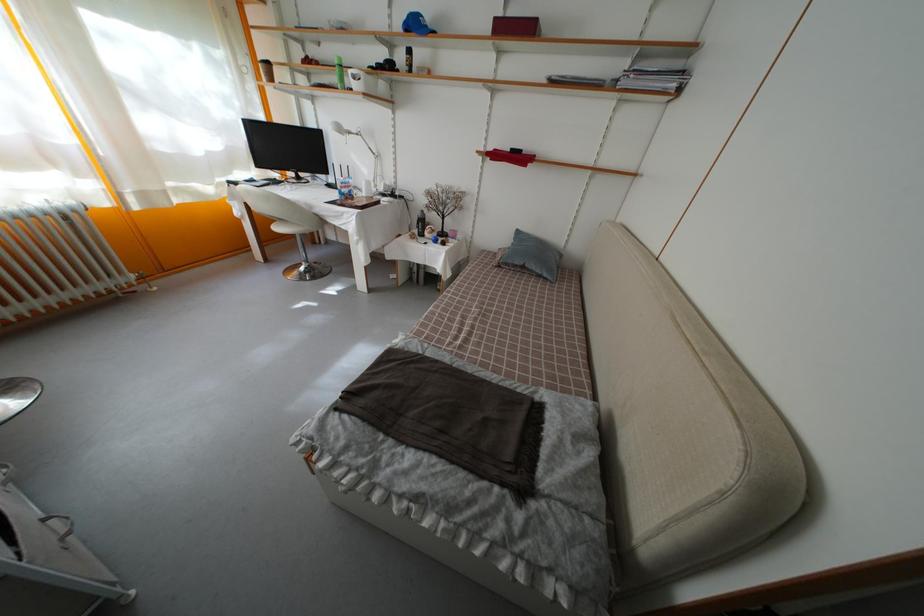
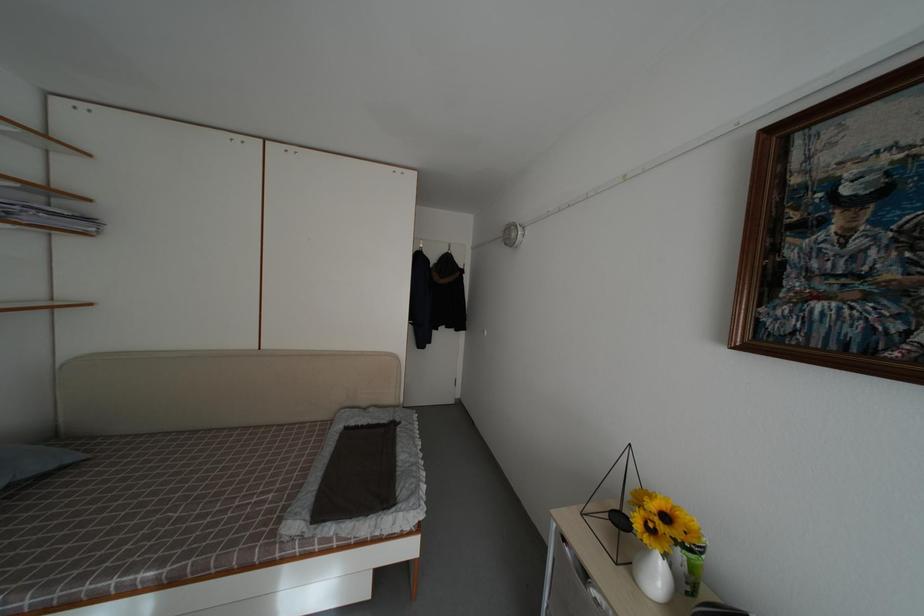
In the second image, find the point that corresponds to [688,79] in the first image.

(94, 225)